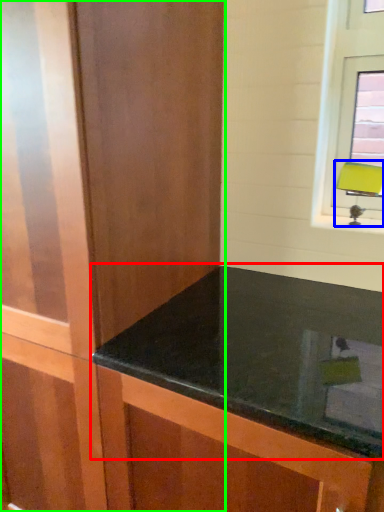
Question: Considering the real-world distances, which object is closest to countertop (highlighted by a red box)? table lamp (highlighted by a blue box) or dresser (highlighted by a green box).

Choices:
 (A) table lamp
 (B) dresser

Answer: (B)